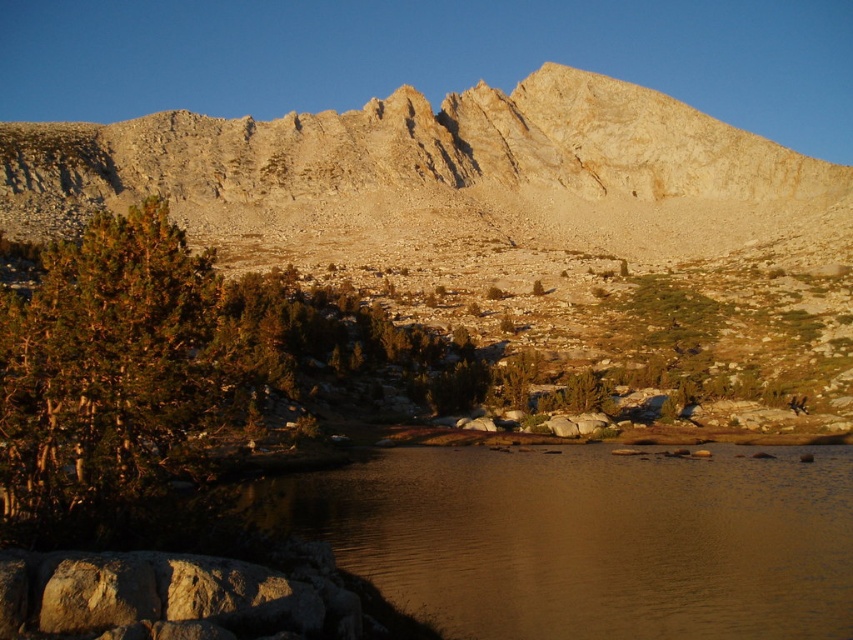
You are a hiker who wants to cross the brown water at center to reach the green shrubbery at lower left. Which direction should you walk to avoid stepping into the water?

The green shrubbery at lower left is positioned on the right side of brown water at center, so you should walk towards the right side of brown water at center to reach the green shrubbery at lower left without crossing the water.